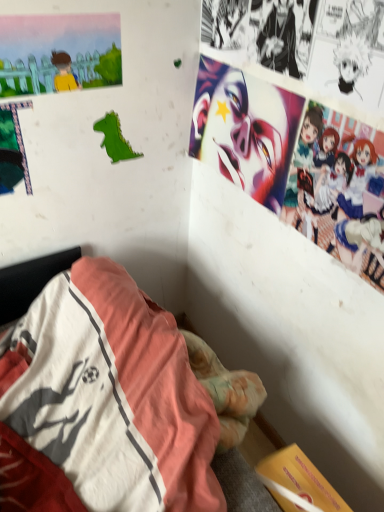
Question: Would you say black paper at upper right, the 1th person positioned from the top, is a long distance from pastel-colored anime characters at upper right, which ranks as the 1th person in bottom-to-top order?

Choices:
 (A) yes
 (B) no

Answer: (B)

Question: Can you confirm if black paper at upper right, arranged as the 2th person when viewed from the right, is wider than pastel-colored anime characters at upper right, the first person positioned from the right?

Choices:
 (A) yes
 (B) no

Answer: (B)

Question: Considering the relative sizes of black paper at upper right, arranged as the 2th person when viewed from the right, and pastel-colored anime characters at upper right, marked as the second person in a left-to-right arrangement, in the image provided, is black paper at upper right, arranged as the 2th person when viewed from the right, thinner than pastel-colored anime characters at upper right, marked as the second person in a left-to-right arrangement,?

Choices:
 (A) no
 (B) yes

Answer: (B)

Question: Is black paper at upper right, the 1th person positioned from the top, taller than pastel-colored anime characters at upper right, marked as the 2th person in a top-to-bottom arrangement?

Choices:
 (A) no
 (B) yes

Answer: (A)

Question: Is black paper at upper right, the 2th person in the bottom-to-top sequence, at the left side of pastel-colored anime characters at upper right, the first person positioned from the right?

Choices:
 (A) yes
 (B) no

Answer: (A)

Question: Looking at the image, does green paper dinosaur at upper left seem bigger or smaller compared to pastel-colored anime characters at upper right, the first person positioned from the right?

Choices:
 (A) big
 (B) small

Answer: (B)

Question: In terms of height, does green paper dinosaur at upper left look taller or shorter compared to pastel-colored anime characters at upper right, the first person positioned from the right?

Choices:
 (A) short
 (B) tall

Answer: (A)

Question: Is point (117, 139) closer or farther from the camera than point (354, 137)?

Choices:
 (A) farther
 (B) closer

Answer: (A)

Question: In the image, is green paper dinosaur at upper left positioned in front of or behind pastel-colored anime characters at upper right, which ranks as the 1th person in bottom-to-top order?

Choices:
 (A) behind
 (B) front

Answer: (A)

Question: Considering the positions of vivid matte clown face at upper right and black paper at upper right, arranged as the 2th person when viewed from the right, in the image, is vivid matte clown face at upper right taller or shorter than black paper at upper right, arranged as the 2th person when viewed from the right,?

Choices:
 (A) short
 (B) tall

Answer: (B)

Question: Is vivid matte clown face at upper right in front of or behind black paper at upper right, which ranks as the first person in left-to-right order, in the image?

Choices:
 (A) behind
 (B) front

Answer: (A)

Question: From a real-world perspective, is vivid matte clown face at upper right physically located above or below black paper at upper right, which ranks as the first person in left-to-right order?

Choices:
 (A) below
 (B) above

Answer: (A)

Question: Is vivid matte clown face at upper right spatially inside black paper at upper right, the 1th person positioned from the top, or outside of it?

Choices:
 (A) outside
 (B) inside

Answer: (A)

Question: Is green paper dinosaur at upper left wider or thinner than vivid matte clown face at upper right?

Choices:
 (A) wide
 (B) thin

Answer: (B)

Question: Which is correct: green paper dinosaur at upper left is inside vivid matte clown face at upper right, or outside of it?

Choices:
 (A) inside
 (B) outside

Answer: (B)